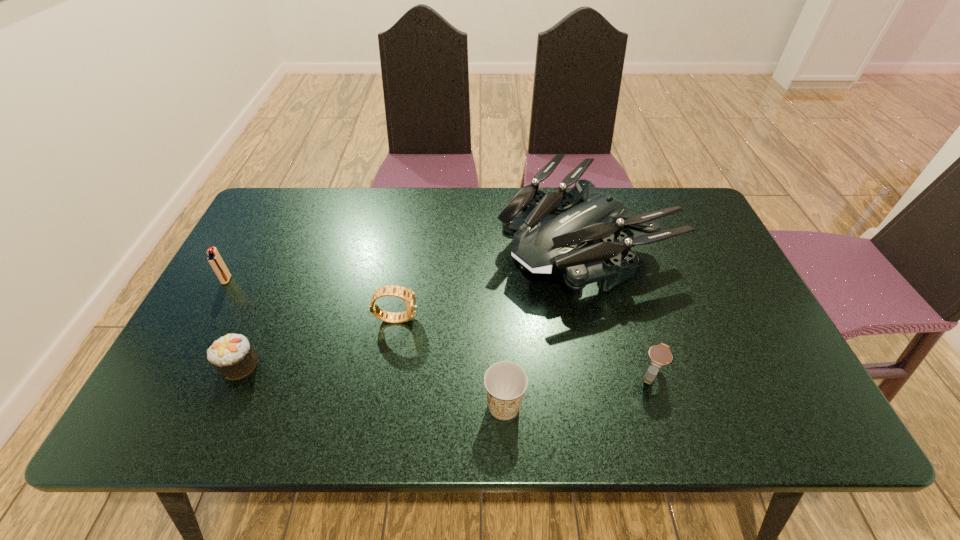
Find the location of a particular element. The image size is (960, 540). free space at the far edge of the desktop is located at coordinates (493, 215).

Locate an element on the screen. blank space at the near edge of the desktop is located at coordinates (485, 420).

The height and width of the screenshot is (540, 960). What are the coordinates of `blank space at the left edge of the desktop` in the screenshot? It's located at (263, 309).

Find the location of a particular element. The height and width of the screenshot is (540, 960). free space at the right edge of the desktop is located at coordinates (704, 285).

The height and width of the screenshot is (540, 960). Find the location of `free space at the far left corner of the desktop`. free space at the far left corner of the desktop is located at coordinates (302, 188).

Where is `vacant area at the near left corner of the desktop`? This screenshot has width=960, height=540. vacant area at the near left corner of the desktop is located at coordinates (215, 421).

The image size is (960, 540). Identify the location of vacant space that's between the leftmost object and the taller watch. (311, 299).

Find the location of `vacant space that's between the drone and the leftmost object`. vacant space that's between the drone and the leftmost object is located at coordinates point(403,261).

I want to click on vacant area between the shorter watch and the Dixie cup, so click(577, 391).

Image resolution: width=960 pixels, height=540 pixels. In order to click on free space between the leftmost object and the second object from left to right in this screenshot , I will do `click(233, 322)`.